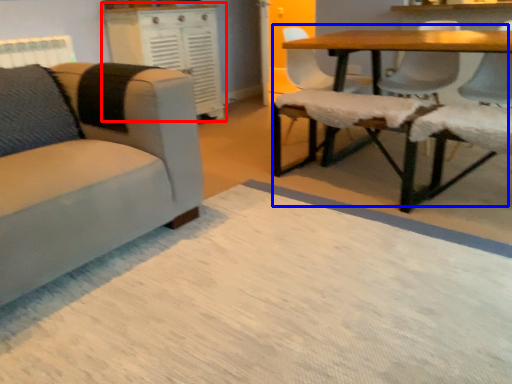
Question: Which object is further to the camera taking this photo, dresser (highlighted by a red box) or table (highlighted by a blue box)?

Choices:
 (A) dresser
 (B) table

Answer: (A)